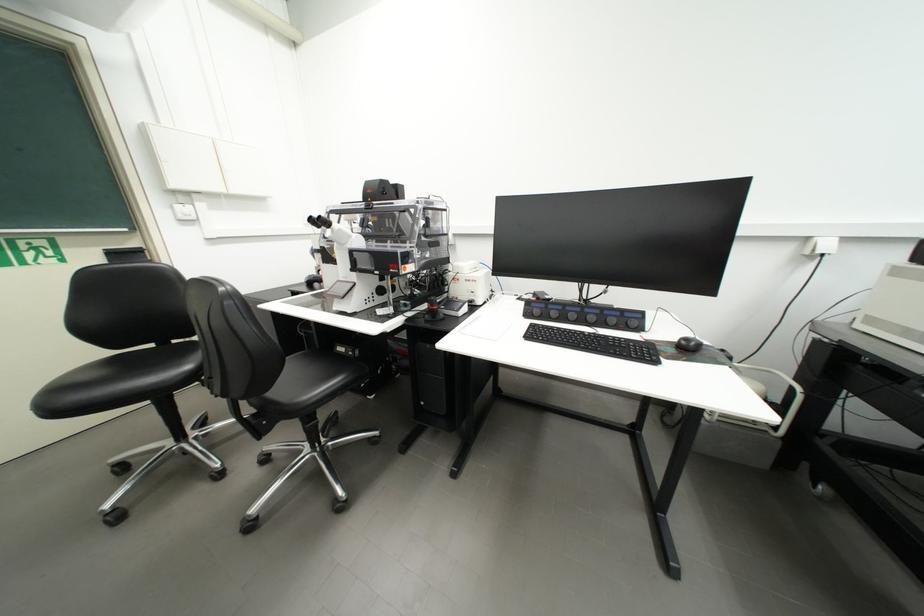
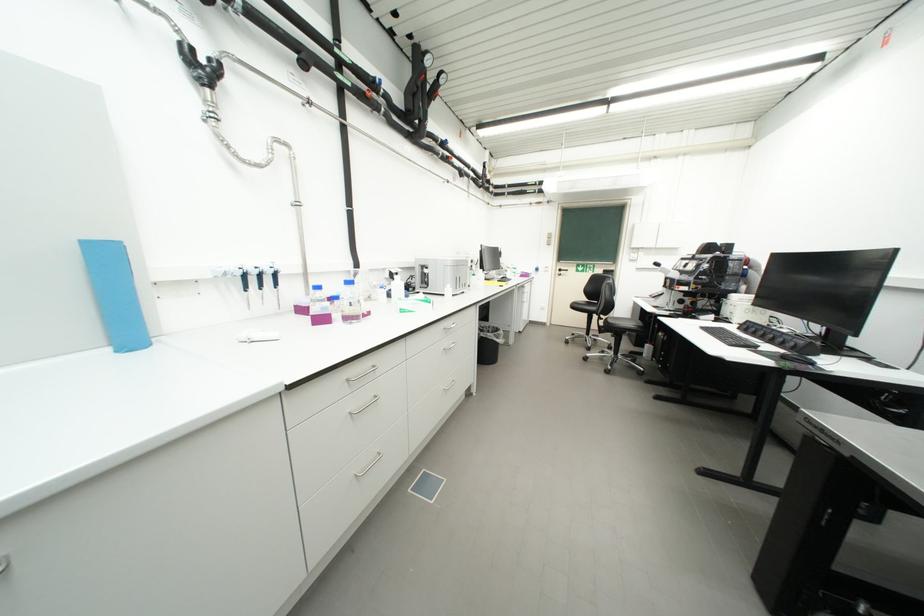
Locate, in the second image, the point that corresponds to (560,330) in the first image.

(734, 331)